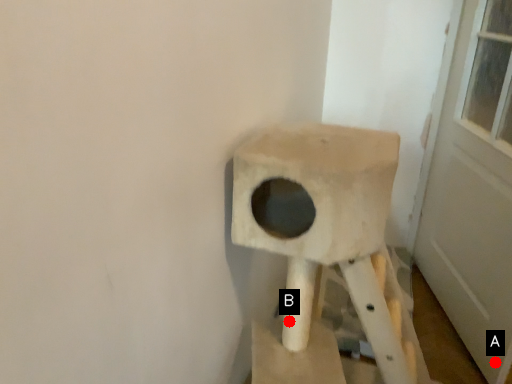
Question: Two points are circled on the image, labeled by A and B beside each circle. Among these points, which one is nearest to the camera?

Choices:
 (A) A is closer
 (B) B is closer

Answer: (B)